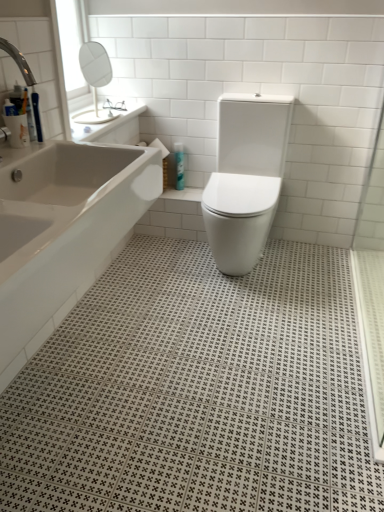
Question: Is white glossy bathtub at left completely or partially inside blue glossy bottle at center?

Choices:
 (A) no
 (B) yes

Answer: (A)

Question: Is blue glossy bottle at center oriented towards white glossy bathtub at left?

Choices:
 (A) yes
 (B) no

Answer: (A)

Question: Can you confirm if blue glossy bottle at center is smaller than white glossy bathtub at left?

Choices:
 (A) yes
 (B) no

Answer: (A)

Question: Is blue glossy bottle at center not inside white glossy bathtub at left?

Choices:
 (A) yes
 (B) no

Answer: (A)

Question: Is blue glossy bottle at center at the left side of white glossy bathtub at left?

Choices:
 (A) yes
 (B) no

Answer: (B)

Question: Is there a large distance between blue glossy bottle at center and white glossy bathtub at left?

Choices:
 (A) no
 (B) yes

Answer: (B)

Question: From a real-world perspective, is white glossy bathtub at left physically below white glossy toilet at center?

Choices:
 (A) no
 (B) yes

Answer: (A)

Question: Is white glossy bathtub at left aimed at white glossy toilet at center?

Choices:
 (A) yes
 (B) no

Answer: (B)

Question: Are white glossy bathtub at left and white glossy toilet at center located far from each other?

Choices:
 (A) no
 (B) yes

Answer: (A)

Question: Would you say white glossy toilet at center is part of white glossy bathtub at left's contents?

Choices:
 (A) no
 (B) yes

Answer: (A)

Question: Considering the relative sizes of white glossy bathtub at left and white glossy toilet at center in the image provided, is white glossy bathtub at left taller than white glossy toilet at center?

Choices:
 (A) no
 (B) yes

Answer: (A)

Question: Is white glossy bathtub at left positioned with its back to white glossy toilet at center?

Choices:
 (A) no
 (B) yes

Answer: (A)

Question: Considering the relative positions of white glossy toilet at center and blue glossy bottle at center in the image provided, is white glossy toilet at center in front of blue glossy bottle at center?

Choices:
 (A) yes
 (B) no

Answer: (A)